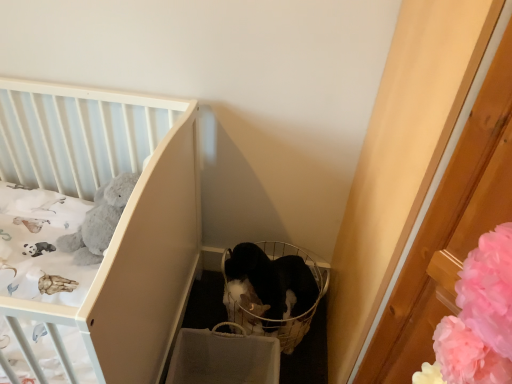
Question: Is white matte crib at upper left not close to black fabric basket at center?

Choices:
 (A) yes
 (B) no

Answer: (B)

Question: Can you confirm if white matte crib at upper left is bigger than black fabric basket at center?

Choices:
 (A) yes
 (B) no

Answer: (A)

Question: From a real-world perspective, is white matte crib at upper left positioned under black fabric basket at center based on gravity?

Choices:
 (A) no
 (B) yes

Answer: (A)

Question: Is white matte crib at upper left aimed at black fabric basket at center?

Choices:
 (A) no
 (B) yes

Answer: (A)

Question: Can you confirm if white matte crib at upper left is positioned to the right of black fabric basket at center?

Choices:
 (A) no
 (B) yes

Answer: (A)

Question: Is white matte crib at upper left smaller than black fabric basket at center?

Choices:
 (A) no
 (B) yes

Answer: (A)

Question: Is black fur cat at center wider than white matte crib at upper left?

Choices:
 (A) yes
 (B) no

Answer: (B)

Question: Is black fur cat at center turned away from white matte crib at upper left?

Choices:
 (A) no
 (B) yes

Answer: (A)

Question: Is black fur cat at center not inside white matte crib at upper left?

Choices:
 (A) yes
 (B) no

Answer: (A)

Question: Does black fur cat at center have a smaller size compared to white matte crib at upper left?

Choices:
 (A) yes
 (B) no

Answer: (A)

Question: From a real-world perspective, is black fur cat at center below white matte crib at upper left?

Choices:
 (A) no
 (B) yes

Answer: (B)

Question: Is black fur cat at center taller than white matte crib at upper left?

Choices:
 (A) yes
 (B) no

Answer: (B)

Question: Does black fabric basket at center have a greater height compared to white matte crib at upper left?

Choices:
 (A) yes
 (B) no

Answer: (B)